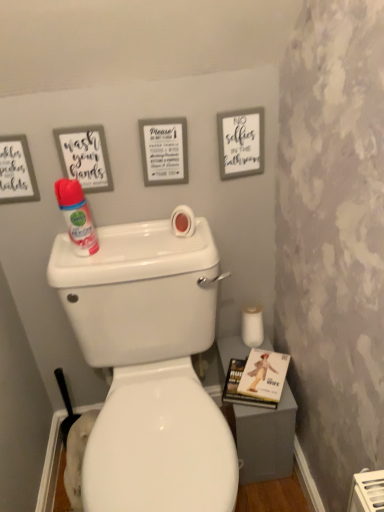
Locate an element on the screen. vacant region to the left of pink matte toilet paper at upper center, which is counted as the first toilet paper, starting from the front is located at coordinates (142, 248).